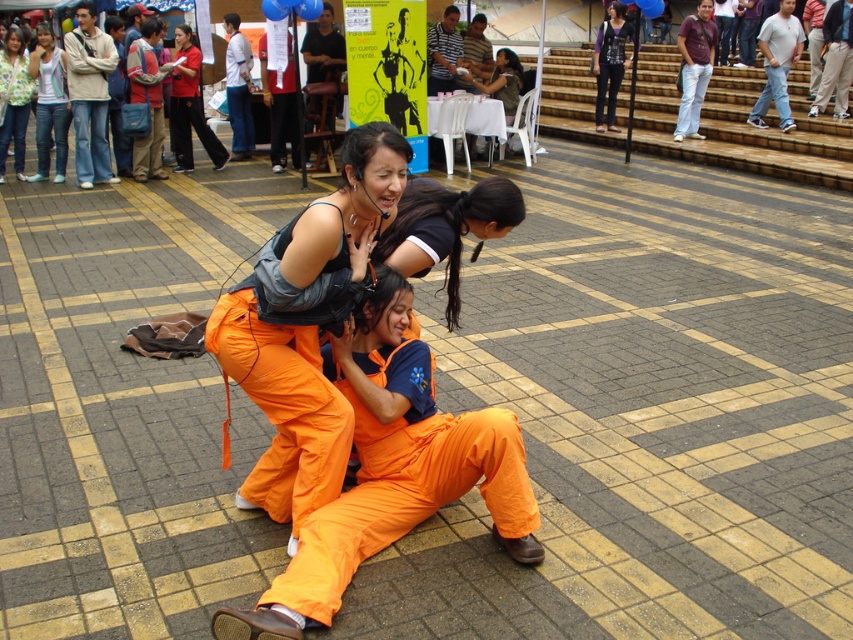
Between orange fabric squat at center and matte black shirt at center, which one has more height?

Standing taller between the two is matte black shirt at center.

Describe the element at coordinates (392, 468) in the screenshot. I see `orange fabric squat at center` at that location.

Between point (219, 632) and point (496, 56), which one is positioned behind?

Point (496, 56)

In order to click on orange fabric squat at center in this screenshot , I will do `click(392, 468)`.

Locate an element on the screen. This screenshot has height=640, width=853. light blue denim jeans at upper left is located at coordinates (49, 104).

Is point (48, 60) in front of point (518, 74)?

That is True.

Where is `light blue denim jeans at upper left`? The image size is (853, 640). light blue denim jeans at upper left is located at coordinates (49, 104).

Who is shorter, matte orange jumpsuit at center or light blue denim jeans at upper left?

matte orange jumpsuit at center is shorter.

The image size is (853, 640). I want to click on matte orange jumpsuit at center, so click(x=306, y=326).

Where is `matte orange jumpsuit at center`? matte orange jumpsuit at center is located at coordinates 306,326.